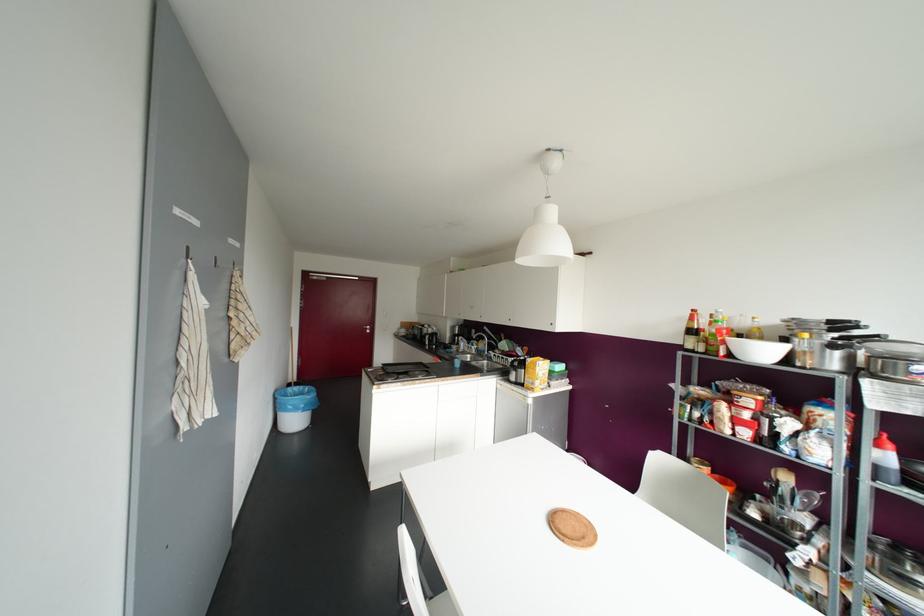
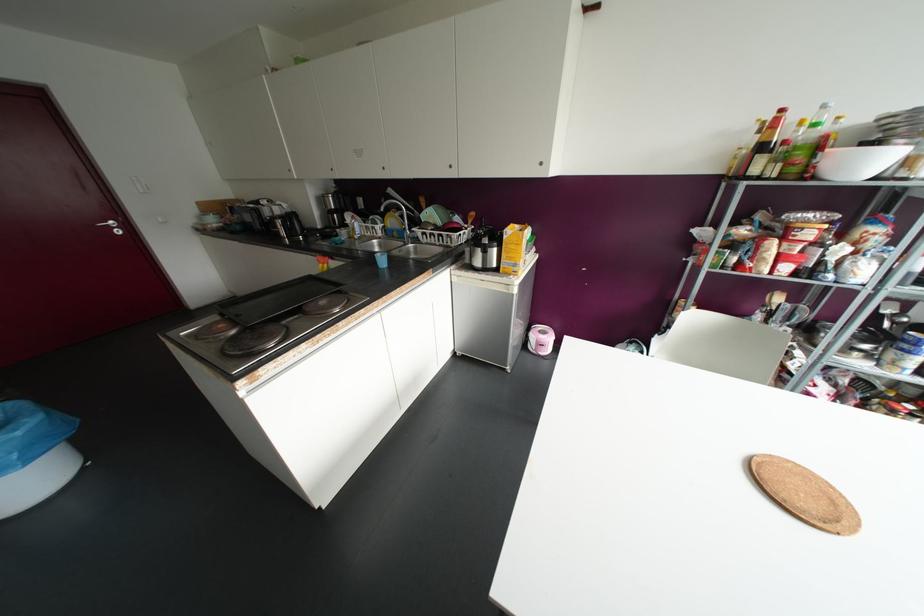
Where in the second image is the point corresponding to point 693,310 from the first image?

(781, 110)